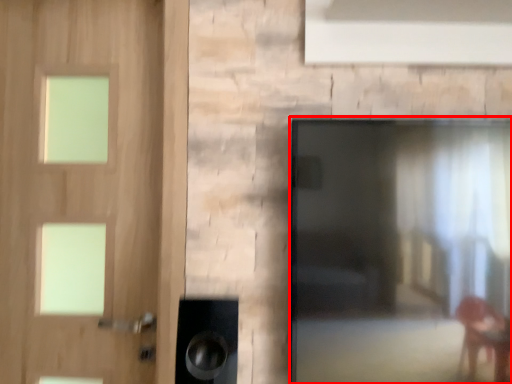
Question: Where is screen door (annotated by the red box) located in relation to door in the image?

Choices:
 (A) left
 (B) right

Answer: (B)